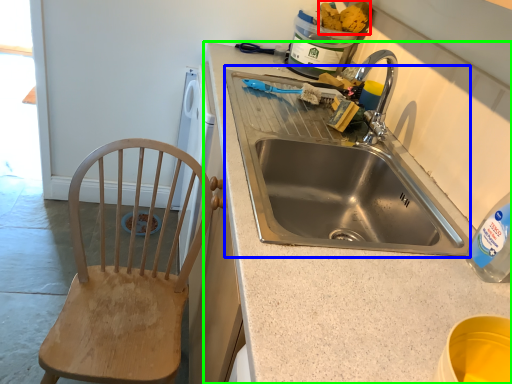
Question: Based on their relative distances, which object is nearer to food (highlighted by a red box)? Choose from sink (highlighted by a blue box) and countertop (highlighted by a green box).

Choices:
 (A) sink
 (B) countertop

Answer: (A)